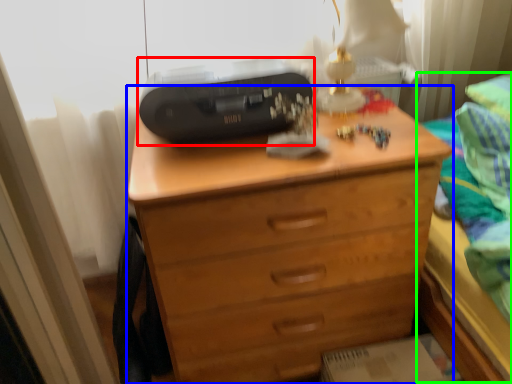
Question: Based on their relative distances, which object is nearer to printer (highlighted by a red box)? Choose from chest of drawers (highlighted by a blue box) and bed (highlighted by a green box).

Choices:
 (A) chest of drawers
 (B) bed

Answer: (A)